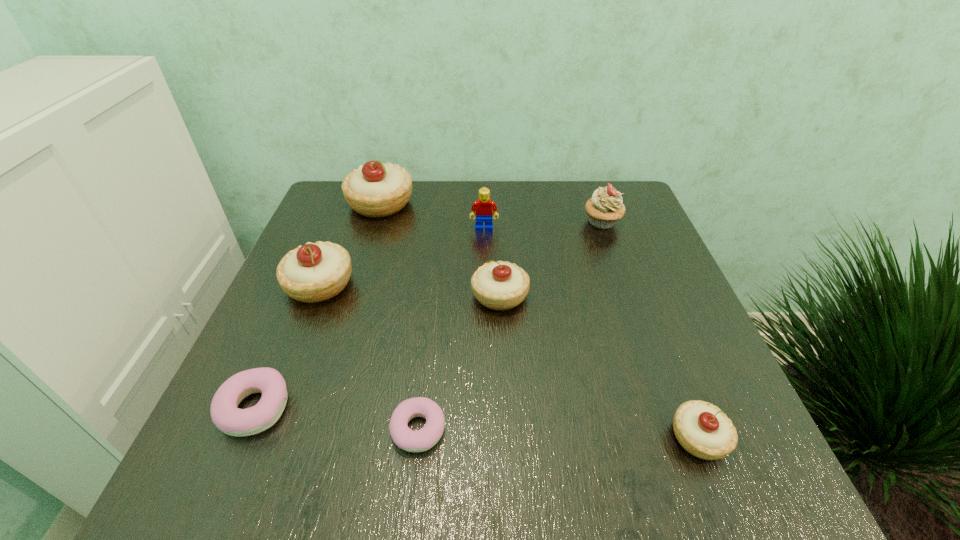
You are a GUI agent. You are given a task and a screenshot of the screen. Output one action in this format:
    pyautogui.click(x=<x>, y=<y>)
    Task: Click on the second shortest pastry
    
    Given the screenshot: What is the action you would take?
    pyautogui.click(x=231, y=420)

Image resolution: width=960 pixels, height=540 pixels. Identify the location of the shortest pastry. (421, 440).

Identify the location of the fourth object from left to right. Image resolution: width=960 pixels, height=540 pixels. (421, 440).

This screenshot has width=960, height=540. I want to click on vacant area situated on the right of the biggest beige pastry, so click(x=522, y=204).

Identify the location of free region located on the front of the cupcake. (637, 322).

Identify the location of vacant space located on the front-facing side of the red Lego. The height and width of the screenshot is (540, 960). (485, 290).

At what (x,y) coordinates should I click in order to perform the action: click on free space located 0.080m on the back of the fifth shortest pastry. Please return your answer as a coordinate pair (x, y). Looking at the image, I should click on (337, 241).

At what (x,y) coordinates should I click in order to perform the action: click on blank area located 0.370m on the back of the third biggest beige pastry. Please return your answer as a coordinate pair (x, y). This screenshot has width=960, height=540. Looking at the image, I should click on (494, 188).

You are a GUI agent. You are given a task and a screenshot of the screen. Output one action in this format:
    pyautogui.click(x=<x>, y=<y>)
    Task: Click on the blank space located on the left of the rightmost beige pastry
    The width and height of the screenshot is (960, 540).
    Given the screenshot: What is the action you would take?
    pyautogui.click(x=511, y=437)

Image resolution: width=960 pixels, height=540 pixels. Identify the location of vacant area situated on the back of the left pink pastry. (306, 288).